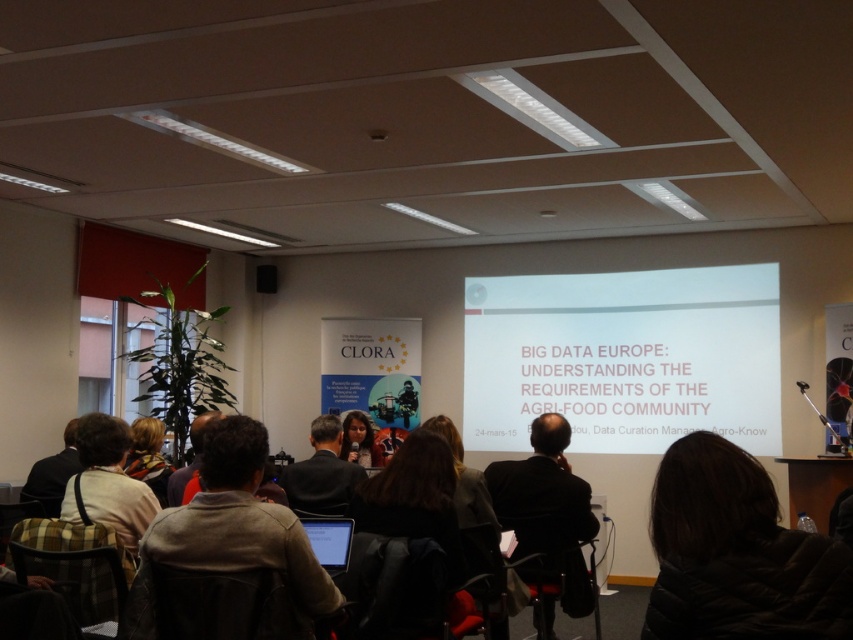
You are an attendee at this conference and want to retrieve your black puffer jacket at lower right from the back of the seat. Can you reach it without moving the light brown leather jacket at lower left?

The black puffer jacket at lower right is in front of the light brown leather jacket at lower left, so you can reach it without moving the light brown leather jacket at lower left.

You are an attendee at the conference and you need to retrieve your black puffer jacket at lower right and light brown leather jacket at lower left from the floor. Which jacket do you need to bend down more to pick up?

The light brown leather jacket at lower left requires bending down more because the black puffer jacket at lower right is located above it.